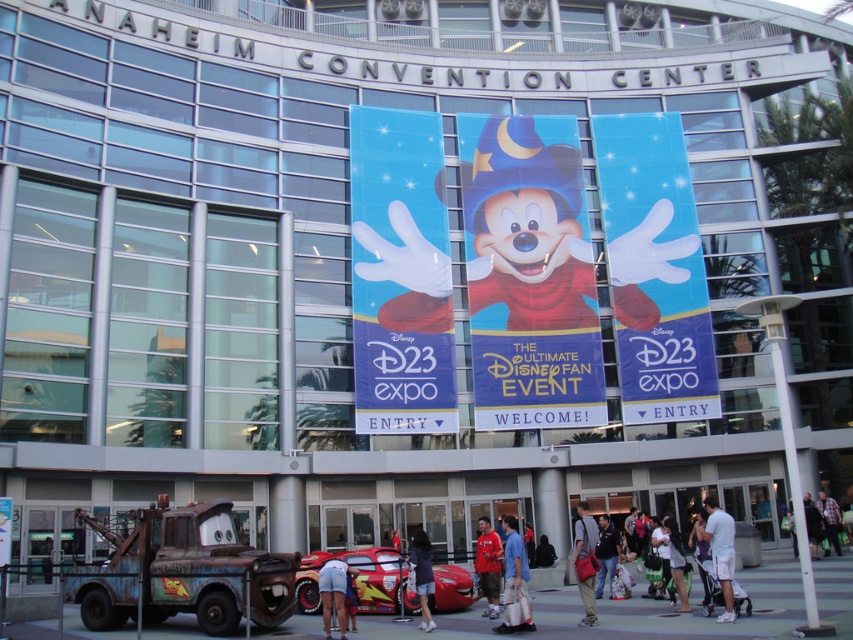
Is red cotton shirt at center further to the viewer compared to matte black backpack at center?

Yes, it is behind matte black backpack at center.

Who is more distant from viewer, (494, 588) or (581, 580)?

Point (494, 588)

Who is more forward, (492, 536) or (590, 595)?

Point (590, 595)

Identify the location of red cotton shirt at center. (488, 564).

How much distance is there between matte wizard hat at center and plaid fabric shirt at lower right?

matte wizard hat at center is 21.49 meters away from plaid fabric shirt at lower right.

Does matte wizard hat at center have a greater height compared to plaid fabric shirt at lower right?

Indeed, matte wizard hat at center has a greater height compared to plaid fabric shirt at lower right.

Between point (552, 420) and point (834, 548), which one is positioned in front?

Point (834, 548)

The image size is (853, 640). I want to click on matte wizard hat at center, so click(529, 275).

Is the position of white cotton shirt at center more distant than that of dark blue jacket at center?

That is False.

Is point (730, 618) behind point (612, 560)?

That is False.

Where is `white cotton shirt at center`? The width and height of the screenshot is (853, 640). white cotton shirt at center is located at coordinates (720, 552).

Where is `white cotton shirt at center`? white cotton shirt at center is located at coordinates (720, 552).